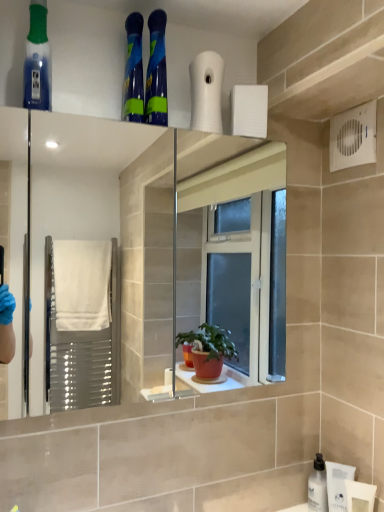
Question: Is white matte bottle at lower right bigger than translucent blue mouthwash at upper left?

Choices:
 (A) no
 (B) yes

Answer: (A)

Question: Is white matte bottle at lower right shorter than translucent blue mouthwash at upper left?

Choices:
 (A) yes
 (B) no

Answer: (A)

Question: Is white matte bottle at lower right with translucent blue mouthwash at upper left?

Choices:
 (A) yes
 (B) no

Answer: (B)

Question: From the image's perspective, is white matte bottle at lower right located beneath translucent blue mouthwash at upper left?

Choices:
 (A) no
 (B) yes

Answer: (B)

Question: Does white matte bottle at lower right turn towards translucent blue mouthwash at upper left?

Choices:
 (A) yes
 (B) no

Answer: (B)

Question: Considering the positions of white matte bottle at lower right and white plastic bottle at lower right in the image, is white matte bottle at lower right taller or shorter than white plastic bottle at lower right?

Choices:
 (A) tall
 (B) short

Answer: (B)

Question: Would you say white matte bottle at lower right is to the left or to the right of white plastic bottle at lower right in the picture?

Choices:
 (A) right
 (B) left

Answer: (B)

Question: In the image, is white matte bottle at lower right positioned in front of or behind white plastic bottle at lower right?

Choices:
 (A) behind
 (B) front

Answer: (A)

Question: From a real-world perspective, is white matte bottle at lower right above or below white plastic bottle at lower right?

Choices:
 (A) below
 (B) above

Answer: (A)

Question: Considering their positions, is translucent blue mouthwash at upper left located in front of or behind white matte bottle at lower right?

Choices:
 (A) front
 (B) behind

Answer: (A)

Question: Would you say translucent blue mouthwash at upper left is inside or outside white matte bottle at lower right?

Choices:
 (A) inside
 (B) outside

Answer: (B)

Question: From their relative heights in the image, would you say translucent blue mouthwash at upper left is taller or shorter than white matte bottle at lower right?

Choices:
 (A) tall
 (B) short

Answer: (A)

Question: Based on their positions, is translucent blue mouthwash at upper left located to the left or right of white matte bottle at lower right?

Choices:
 (A) right
 (B) left

Answer: (B)

Question: From the image's perspective, relative to translucent blue mouthwash at upper left, is white plastic bottle at lower right above or below?

Choices:
 (A) above
 (B) below

Answer: (B)

Question: Is white plastic bottle at lower right taller or shorter than translucent blue mouthwash at upper left?

Choices:
 (A) tall
 (B) short

Answer: (B)